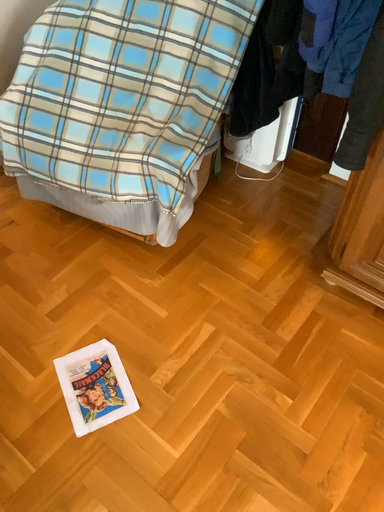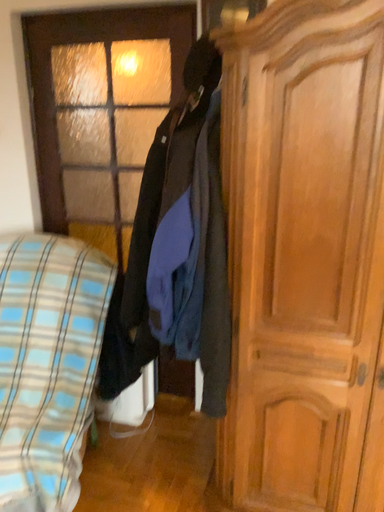
Question: Which way did the camera rotate in the video?

Choices:
 (A) rotated downward
 (B) rotated upward

Answer: (B)